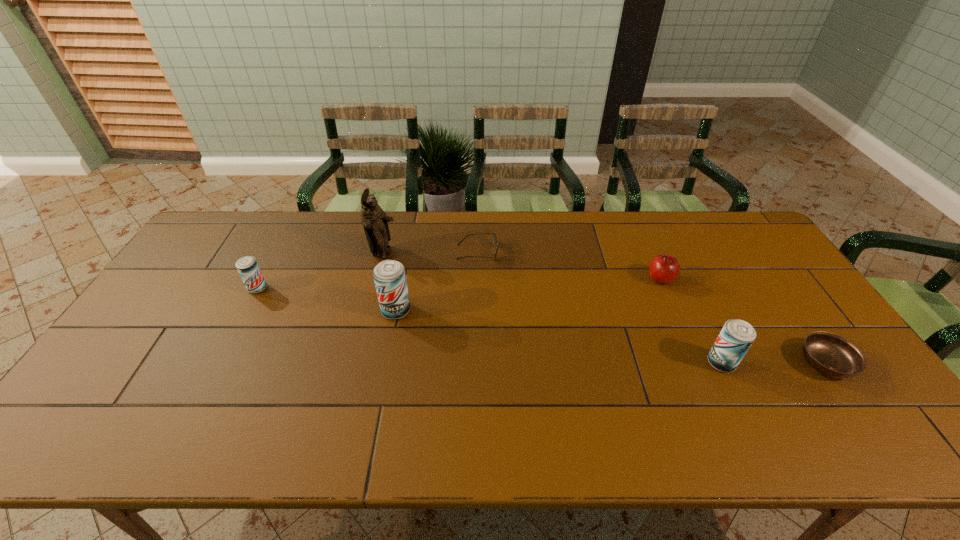
Locate an element on the screen. vacant area that satisfies the following two spatial constraints: 1. on the front-facing side of the figurine; 2. on the front side of the farthest beer can is located at coordinates (375, 288).

Where is `vacant area that satisfies the following two spatial constraints: 1. on the back side of the rightmost object; 2. on the front-facing side of the tallest object`? vacant area that satisfies the following two spatial constraints: 1. on the back side of the rightmost object; 2. on the front-facing side of the tallest object is located at coordinates (750, 254).

Identify the location of free space that satisfies the following two spatial constraints: 1. on the back side of the nearest beer can; 2. on the front-facing side of the sunglasses. The height and width of the screenshot is (540, 960). (667, 252).

Locate an element on the screen. The width and height of the screenshot is (960, 540). vacant area in the image that satisfies the following two spatial constraints: 1. on the back side of the apple; 2. on the right side of the tallest beer can is located at coordinates (402, 279).

This screenshot has width=960, height=540. In order to click on free space that satisfies the following two spatial constraints: 1. on the front side of the rightmost object; 2. on the left side of the leftmost beer can in this screenshot , I will do `click(218, 363)`.

Where is `vacant space that satisfies the following two spatial constraints: 1. on the front side of the leftmost object; 2. on the right side of the soup bowl`? The image size is (960, 540). vacant space that satisfies the following two spatial constraints: 1. on the front side of the leftmost object; 2. on the right side of the soup bowl is located at coordinates click(x=218, y=363).

Identify the location of free point that satisfies the following two spatial constraints: 1. on the front-facing side of the apple; 2. on the left side of the tallest object. Image resolution: width=960 pixels, height=540 pixels. (377, 279).

I want to click on free space in the image that satisfies the following two spatial constraints: 1. on the front-facing side of the fourth object from right to left; 2. on the right side of the soup bowl, so click(x=477, y=363).

Where is `free space that satisfies the following two spatial constraints: 1. on the front-facing side of the sunglasses; 2. on the front side of the farthest beer can`? The image size is (960, 540). free space that satisfies the following two spatial constraints: 1. on the front-facing side of the sunglasses; 2. on the front side of the farthest beer can is located at coordinates pos(477,288).